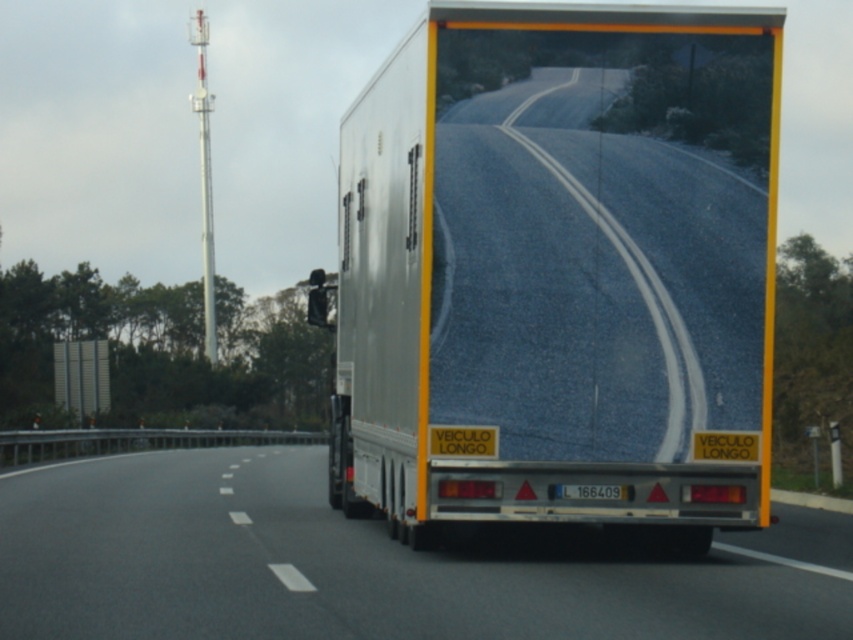
You are a pedestrian trying to cross the highway and see the silver metallic trailer truck at center and the asphalt road at center. Which object is positioned higher from the ground?

The silver metallic trailer truck at center is located above the asphalt road at center, so it is positioned higher from the ground.

You are a delivery driver who needs to park your trailer truck in a parking spot that is 2.5 meters wide. Based on the image, will the silver metallic trailer truck at center fit into the parking spot if it needs to align with the asphalt road at center?

The silver metallic trailer truck at center and asphalt road at center are 2.49 meters apart from each other. Since the parking spot is 2.5 meters wide, the silver metallic trailer truck at center will fit as the required space is slightly less than the available width.

You are a driver approaching the silver metallic trailer truck at center on the asphalt road at center. Can your car, which is 1.8 meters wide, safely pass alongside the truck without crossing into the opposite lane?

The silver metallic trailer truck at center is narrower than the asphalt road at center, so there is sufficient space for your car to safely pass alongside the truck without crossing into the opposite lane.